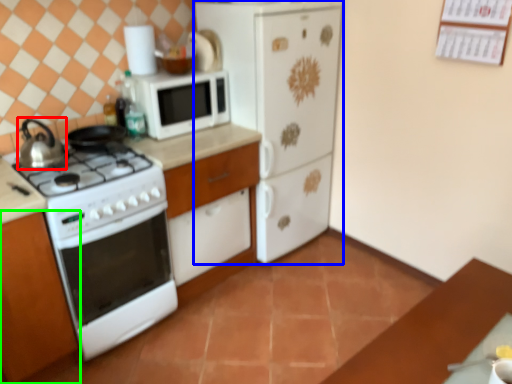
Question: Based on their relative distances, which object is nearer to kitchen appliance (highlighted by a red box)? Choose from home appliance (highlighted by a blue box) and cabinetry (highlighted by a green box).

Choices:
 (A) home appliance
 (B) cabinetry

Answer: (B)